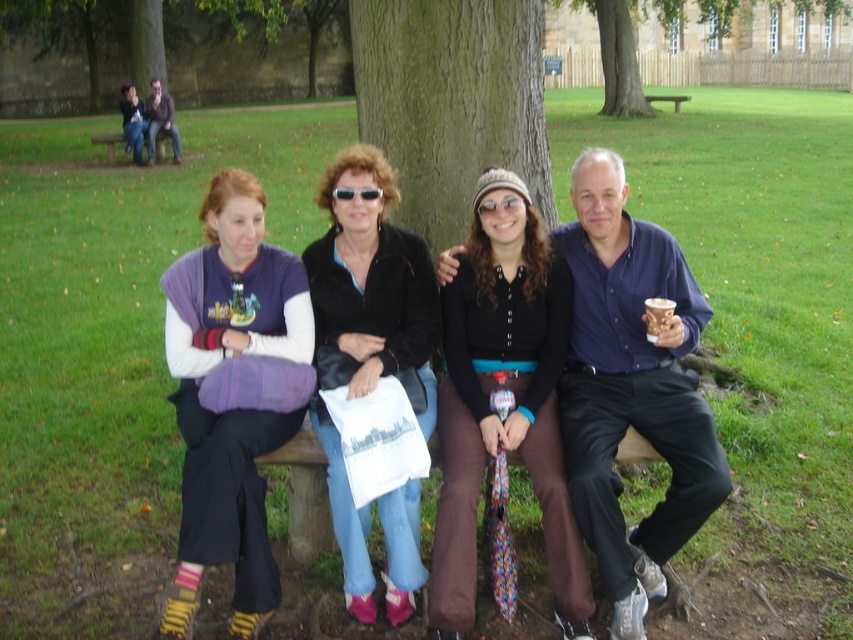
You are standing in the park looking at the wooden bench under the large tree trunk. You need to find the blue shirt at center. Where exactly should you look on the bench?

You should look at point [631,387] on the bench to find the blue shirt at center.

You are standing at the origin point in the park scene. A black matte sweater is located at point (x=514, y=397). If you want to reach the black matte sweater at center, which direction should you move from your current position?

The black matte sweater at center is located at point (x=514, y=397), so you should move towards that coordinate to reach it.

You are standing in front of the wooden bench in the park. You notice two points marked on the bench. The first point is at coordinates point [433,570] and the second point is at point [170,134]. Which point is closer to you?

Point [433,570] is closer to the viewer than point [170,134].